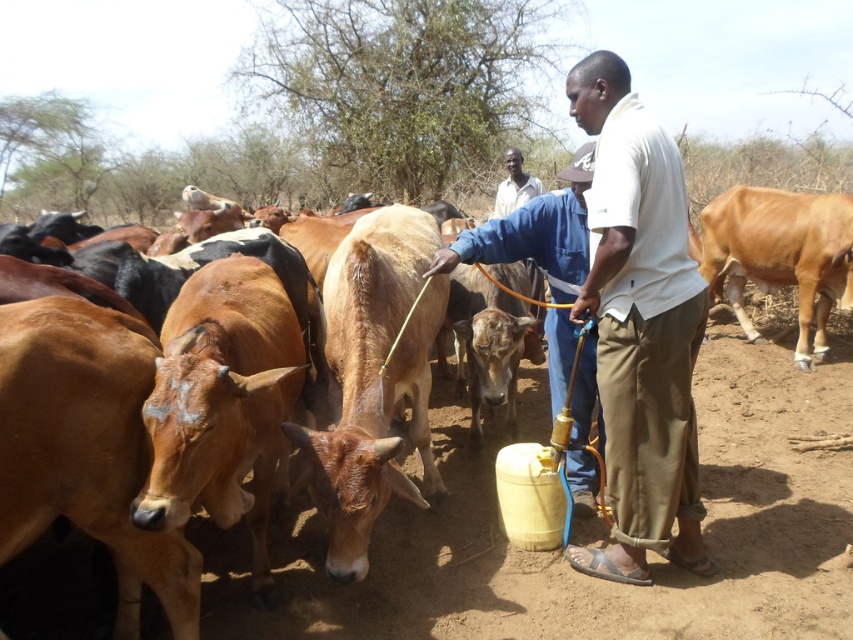
Question: Is light brown smooth cow at right smaller than light brown shirt at center?

Choices:
 (A) no
 (B) yes

Answer: (A)

Question: Can you confirm if white cotton shirt at center is wider than light brown shirt at center?

Choices:
 (A) yes
 (B) no

Answer: (A)

Question: Which object appears farthest from the camera in this image?

Choices:
 (A) light brown smooth cow at right
 (B) white cotton shirt at center
 (C) light brown shirt at center
 (D) blue denim shirt at center

Answer: (C)

Question: Which object is the closest to the light brown smooth cow at right?

Choices:
 (A) blue denim shirt at center
 (B) white cotton shirt at center

Answer: (A)

Question: Does blue denim shirt at center come behind light brown shirt at center?

Choices:
 (A) yes
 (B) no

Answer: (B)

Question: Which of the following is the closest to the observer?

Choices:
 (A) blue denim shirt at center
 (B) light brown shirt at center
 (C) light brown smooth cow at right
 (D) white cotton shirt at center

Answer: (D)